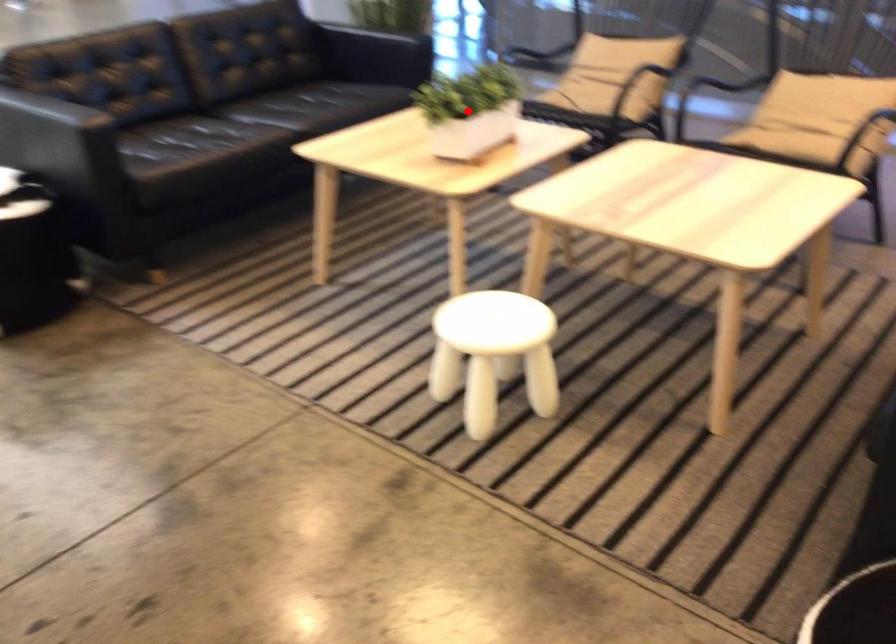
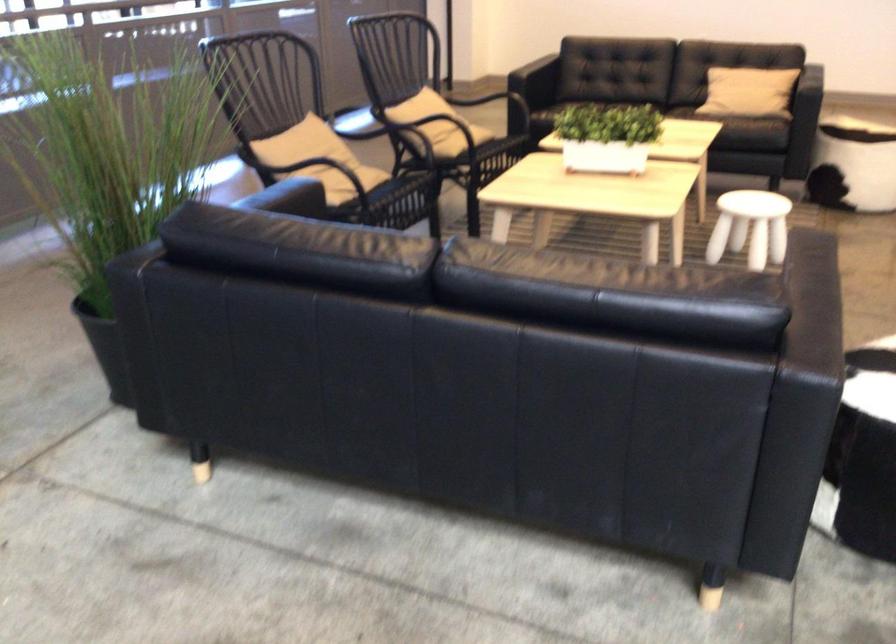
Where in the second image is the point corresponding to the highlighted location from the first image?

(607, 137)